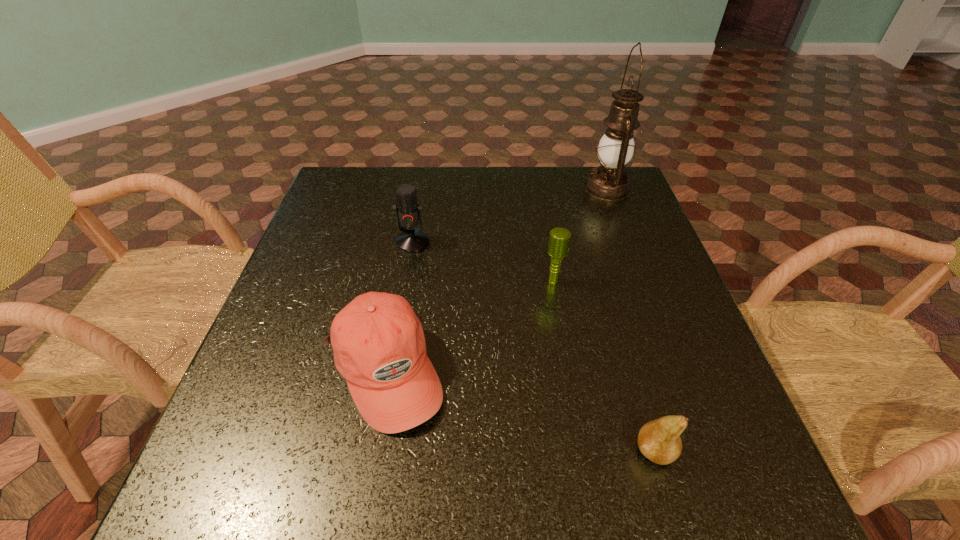
Identify the location of vacant area located 0.140m on the right of the right microphone. (624, 281).

I want to click on free space located on the back of the baseball cap, so click(398, 298).

At what (x,y) coordinates should I click in order to perform the action: click on vacant space situated 0.260m on the left of the shortest object. Please return your answer as a coordinate pair (x, y). Looking at the image, I should click on (478, 451).

Locate an element on the screen. The height and width of the screenshot is (540, 960). object situated at the far edge is located at coordinates (609, 182).

Image resolution: width=960 pixels, height=540 pixels. Find the location of `object located in the near edge section of the desktop`. object located in the near edge section of the desktop is located at coordinates (659, 440).

Locate an element on the screen. Image resolution: width=960 pixels, height=540 pixels. object that is at the left edge is located at coordinates (379, 346).

Identify the location of oil lamp at the right edge. (609, 182).

At what (x,y) coordinates should I click in order to perform the action: click on pear located at the right edge. Please return your answer as a coordinate pair (x, y). The height and width of the screenshot is (540, 960). Looking at the image, I should click on (659, 440).

Where is `object positioned at the far right corner`? Image resolution: width=960 pixels, height=540 pixels. object positioned at the far right corner is located at coordinates (609, 182).

You are a GUI agent. You are given a task and a screenshot of the screen. Output one action in this format:
    pyautogui.click(x=<x>, y=<y>)
    Task: Click on the object that is at the near right corner
    
    Given the screenshot: What is the action you would take?
    pyautogui.click(x=659, y=440)